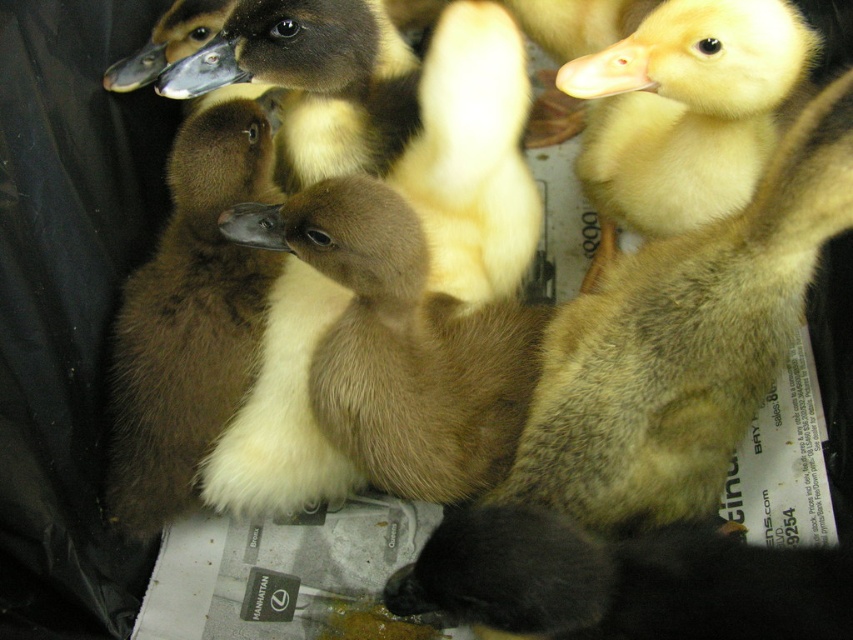
You are a vet examining two ducklings in a container. You notice the brown fluffy duckling at center and the brown fuzzy duckling at center. Which duckling is shorter?

The brown fluffy duckling at center is shorter than the brown fuzzy duckling at center.

You are a wildlife rescuer trying to place two ducklings into a temporary enclosure. You have a small container that can only fit one duckling at a time. Looking at the image, which duckling between the brown fluffy duckling at center and the brown fuzzy duckling at center would you choose to place first into the container?

The brown fluffy duckling at center has a larger width than the brown fuzzy duckling at center, so you should place the brown fuzzy duckling at center first into the container since it is smaller and will fit better initially.